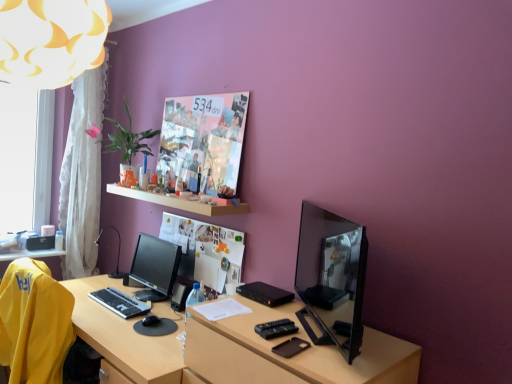
I want to click on free space in front of satin black monitor at center, which is the 1th computer monitor from back to front, so click(137, 314).